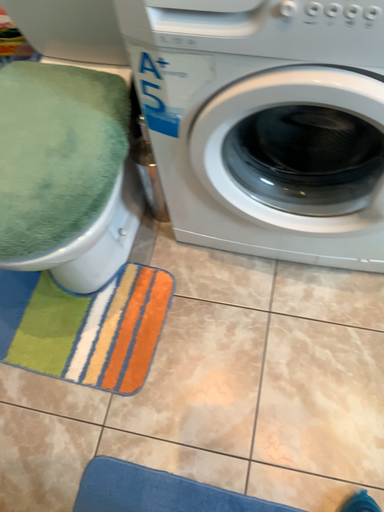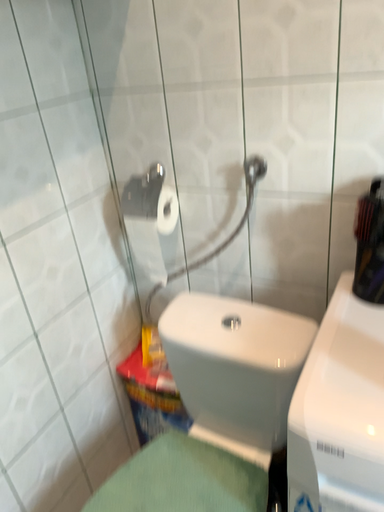
Question: How did the camera likely rotate when shooting the video?

Choices:
 (A) rotated right
 (B) rotated left

Answer: (B)